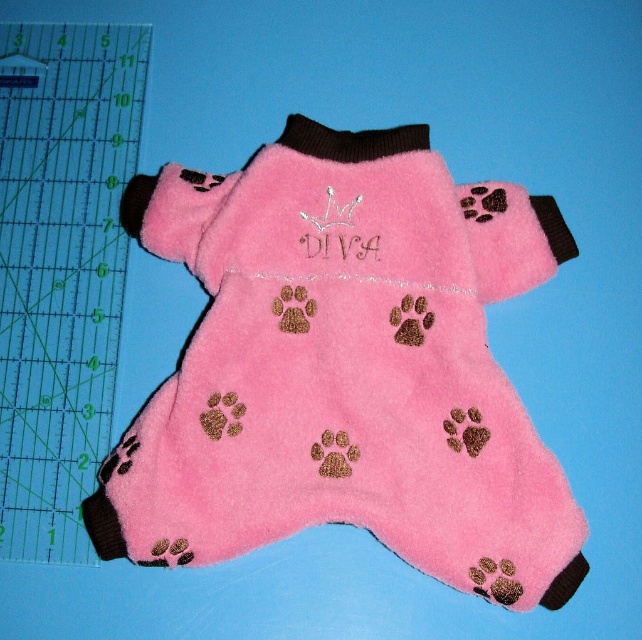
Question: Is pink fleece dog coat at center bigger than transparent plastic ruler at left?

Choices:
 (A) no
 (B) yes

Answer: (B)

Question: Which point is farther to the camera?

Choices:
 (A) (272, 227)
 (B) (28, 381)

Answer: (B)

Question: Can you confirm if pink fleece dog coat at center is positioned to the left of transparent plastic ruler at left?

Choices:
 (A) no
 (B) yes

Answer: (A)

Question: Can you confirm if pink fleece dog coat at center is positioned to the left of transparent plastic ruler at left?

Choices:
 (A) no
 (B) yes

Answer: (A)

Question: Which object is closer to the camera taking this photo?

Choices:
 (A) pink fleece dog coat at center
 (B) transparent plastic ruler at left

Answer: (A)